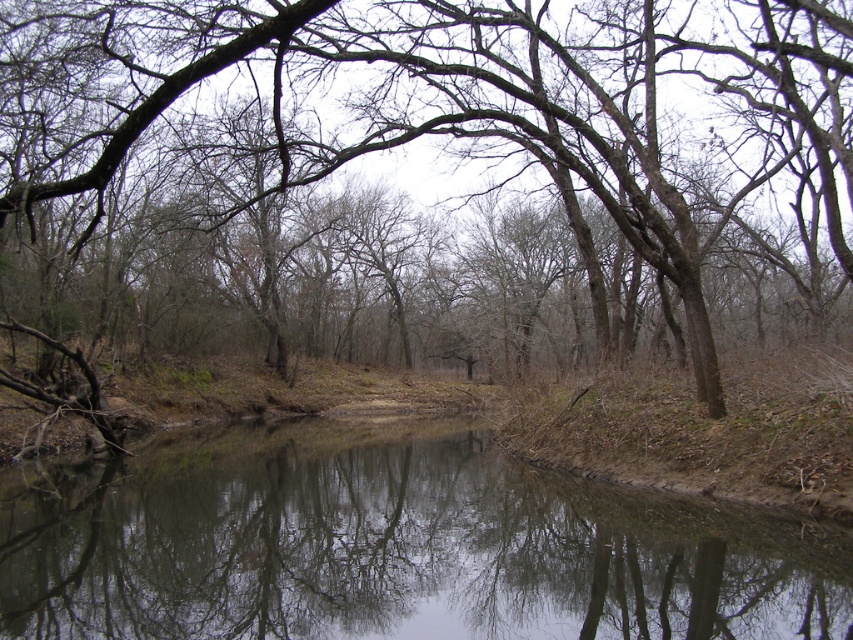
Can you confirm if brown rough tree at center is positioned to the right of clear water at center?

Indeed, brown rough tree at center is positioned on the right side of clear water at center.

Is point (755, 108) behind point (541, 628)?

Yes.

Identify the location of brown rough tree at center. This screenshot has width=853, height=640. (404, 145).